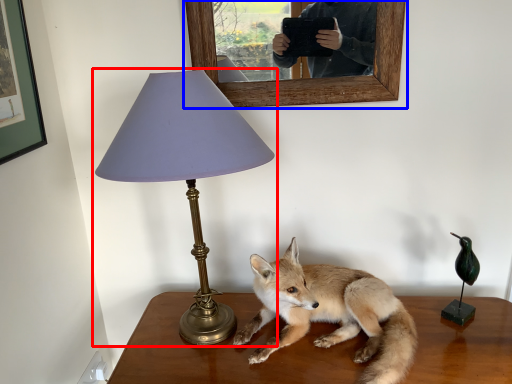
Question: Which object is closer to the camera taking this photo, lamp (highlighted by a red box) or picture frame (highlighted by a blue box)?

Choices:
 (A) lamp
 (B) picture frame

Answer: (A)